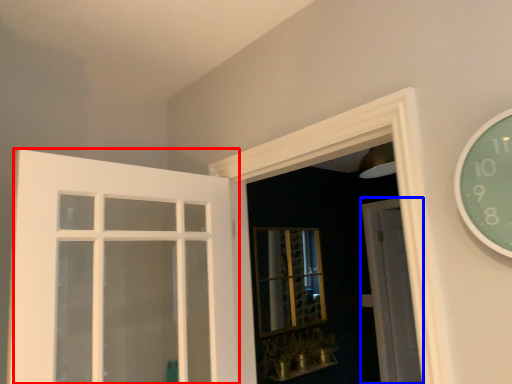
Question: Among these objects, which one is nearest to the camera, door (highlighted by a red box) or door (highlighted by a blue box)?

Choices:
 (A) door
 (B) door

Answer: (A)